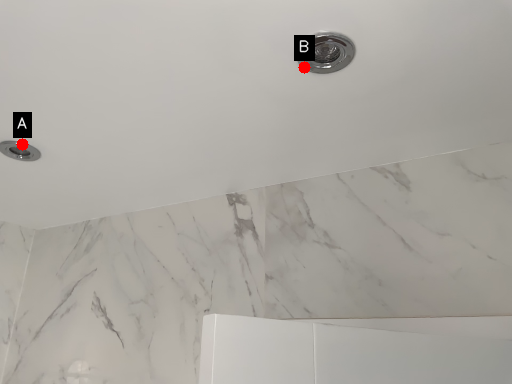
Question: Two points are circled on the image, labeled by A and B beside each circle. Which point is further to the camera?

Choices:
 (A) A is further
 (B) B is further

Answer: (A)